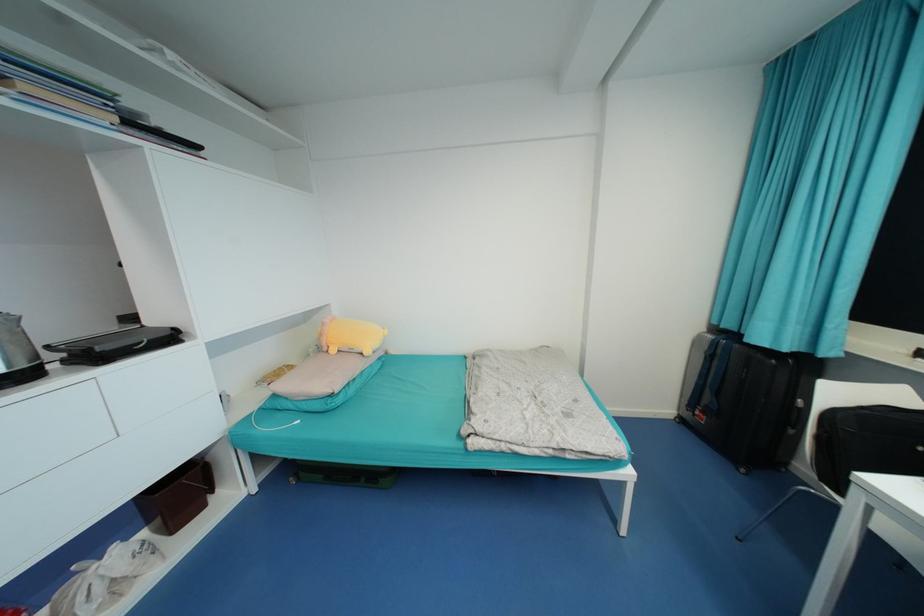
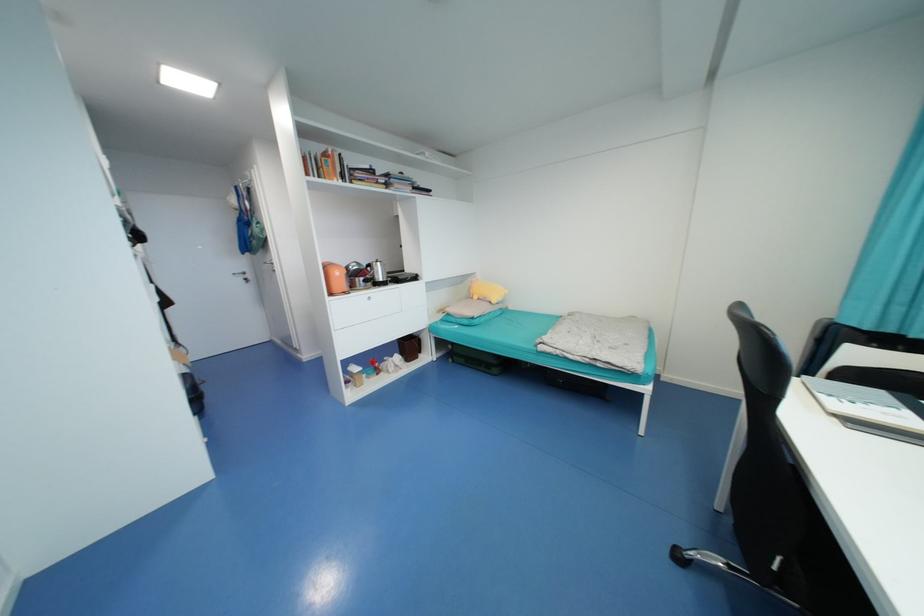
Question: How did the camera likely rotate?

Choices:
 (A) Left
 (B) Right
 (C) Up
 (D) Down

Answer: (A)